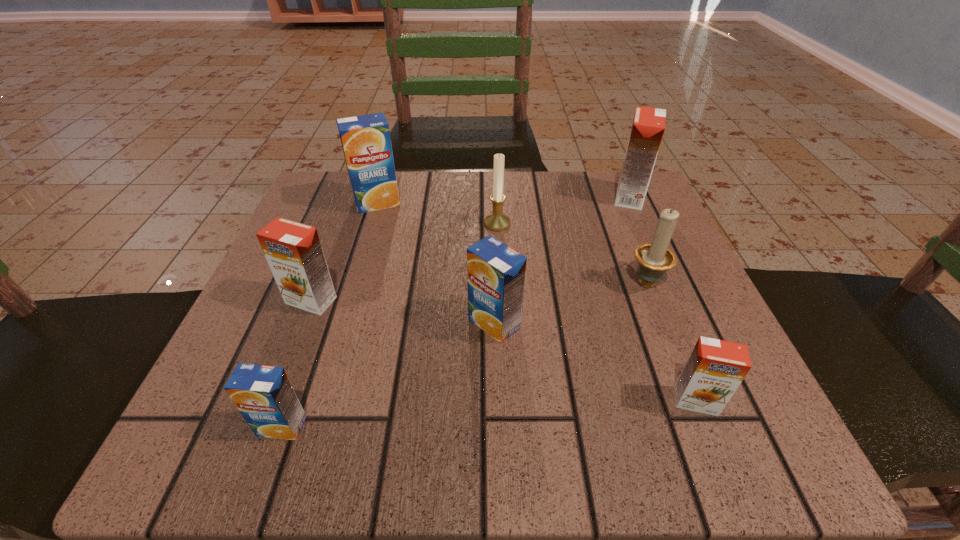
Identify the location of blank space at the right edge of the desktop. The width and height of the screenshot is (960, 540). tap(627, 266).

The width and height of the screenshot is (960, 540). In the image, there is a desktop. Find the location of `vacant space at the far left corner`. vacant space at the far left corner is located at coordinates (315, 183).

This screenshot has width=960, height=540. In the image, there is a desktop. Identify the location of vacant space at the near left corner. (182, 443).

This screenshot has height=540, width=960. What are the coordinates of `vacant space at the far right corner` in the screenshot? It's located at (635, 230).

You are a GUI agent. You are given a task and a screenshot of the screen. Output one action in this format:
    pyautogui.click(x=<x>, y=<y>)
    Task: Click on the vacant space that is in between the smallest blue orange_juice and the biggest blue orange_juice
    Image resolution: width=960 pixels, height=540 pixels.
    Given the screenshot: What is the action you would take?
    pyautogui.click(x=329, y=314)

Where is `free space that is in between the biggest blue orange_juice and the left candle_holder`? Image resolution: width=960 pixels, height=540 pixels. free space that is in between the biggest blue orange_juice and the left candle_holder is located at coordinates (437, 213).

Where is `empty location between the second smallest blue orange_juice and the nearest blue orange_juice`? This screenshot has height=540, width=960. empty location between the second smallest blue orange_juice and the nearest blue orange_juice is located at coordinates (388, 375).

At what (x,y) coordinates should I click in order to perform the action: click on vacant space in between the right candle_holder and the nearest orange orange juice. Please return your answer as a coordinate pair (x, y). Looking at the image, I should click on (670, 341).

At what (x,y) coordinates should I click in order to perform the action: click on vacant space that's between the biggest blue orange_juice and the second nearest orange orange juice. Please return your answer as a coordinate pair (x, y). The height and width of the screenshot is (540, 960). Looking at the image, I should click on (344, 252).

Where is `free space that is in between the biggest blue orange_juice and the second biggest blue orange_juice`? The image size is (960, 540). free space that is in between the biggest blue orange_juice and the second biggest blue orange_juice is located at coordinates (436, 263).